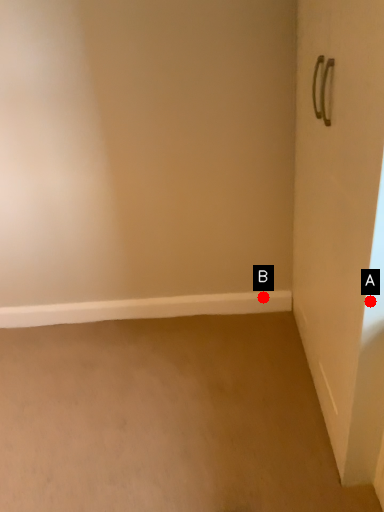
Question: Two points are circled on the image, labeled by A and B beside each circle. Which point appears farthest from the camera in this image?

Choices:
 (A) A is further
 (B) B is further

Answer: (B)